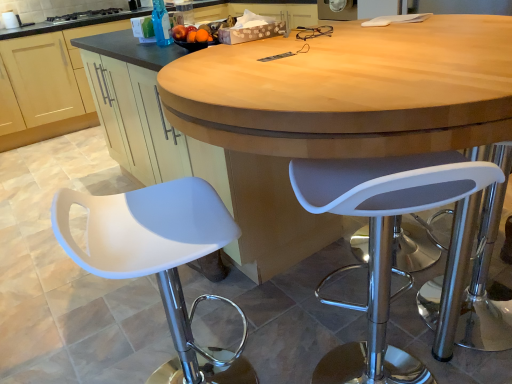
Question: Is white matte stool at left, the 2th chair positioned from the right, at the right side of matte wood cabinet at lower left?

Choices:
 (A) yes
 (B) no

Answer: (A)

Question: Is white matte stool at left, the 2th chair positioned from the right, closer to the viewer compared to matte wood cabinet at lower left?

Choices:
 (A) no
 (B) yes

Answer: (B)

Question: Considering the relative sizes of white matte stool at left, positioned as the first chair in left-to-right order, and matte wood cabinet at lower left in the image provided, is white matte stool at left, positioned as the first chair in left-to-right order, shorter than matte wood cabinet at lower left?

Choices:
 (A) yes
 (B) no

Answer: (A)

Question: Would you consider white matte stool at left, the 2th chair positioned from the right, to be distant from matte wood cabinet at lower left?

Choices:
 (A) yes
 (B) no

Answer: (A)

Question: Is white matte stool at left, the 2th chair positioned from the right, wider than matte wood cabinet at lower left?

Choices:
 (A) yes
 (B) no

Answer: (B)

Question: Can you confirm if white matte stool at left, the 2th chair positioned from the right, is taller than matte wood cabinet at lower left?

Choices:
 (A) no
 (B) yes

Answer: (A)

Question: Is the depth of black glass stove at upper left greater than that of transparent plastic bottle at upper center?

Choices:
 (A) no
 (B) yes

Answer: (B)

Question: Is black glass stove at upper left taller than transparent plastic bottle at upper center?

Choices:
 (A) no
 (B) yes

Answer: (A)

Question: Is black glass stove at upper left thinner than transparent plastic bottle at upper center?

Choices:
 (A) yes
 (B) no

Answer: (B)

Question: From the image's perspective, is black glass stove at upper left on top of transparent plastic bottle at upper center?

Choices:
 (A) no
 (B) yes

Answer: (B)

Question: Can you confirm if black glass stove at upper left is shorter than transparent plastic bottle at upper center?

Choices:
 (A) no
 (B) yes

Answer: (B)

Question: Is the depth of black glass stove at upper left less than that of transparent plastic bottle at upper center?

Choices:
 (A) no
 (B) yes

Answer: (A)

Question: Can you confirm if white matte stool at left, the 2th chair positioned from the right, is bigger than white plastic stool at right, marked as the 2th chair in a left-to-right arrangement?

Choices:
 (A) no
 (B) yes

Answer: (A)